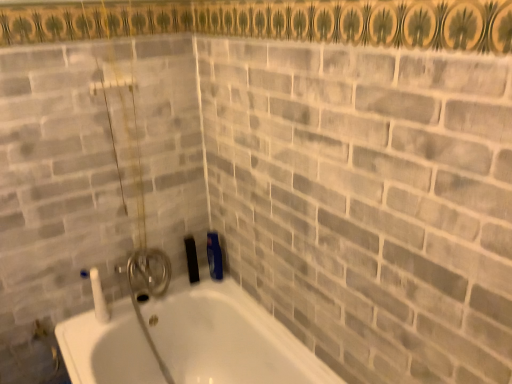
Where is `gray brick at upper center`? This screenshot has width=512, height=384. gray brick at upper center is located at coordinates (367, 201).

Describe the element at coordinates (367, 201) in the screenshot. I see `gray brick at upper center` at that location.

The width and height of the screenshot is (512, 384). Describe the element at coordinates (186, 340) in the screenshot. I see `white glossy bathtub at lower left` at that location.

Measure the distance between white glossy bathtub at lower left and camera.

The distance of white glossy bathtub at lower left from camera is 1.31 meters.

Identify the location of white glossy bathtub at lower left. This screenshot has width=512, height=384. (186, 340).

Identify the location of gray brick at upper center. [367, 201].

Considering the positions of objects white glossy bathtub at lower left and gray brick at upper center in the image provided, who is more to the left, white glossy bathtub at lower left or gray brick at upper center?

Positioned to the left is white glossy bathtub at lower left.

Which object is further away from the camera, white glossy bathtub at lower left or gray brick at upper center?

white glossy bathtub at lower left is further away from the camera.

Does point (276, 335) lie behind point (267, 95)?

That is True.

Based on the photo, from the image's perspective, which is below, white glossy bathtub at lower left or gray brick at upper center?

white glossy bathtub at lower left, from the image's perspective.

From a real-world perspective, between white glossy bathtub at lower left and gray brick at upper center, who is vertically higher?

gray brick at upper center.

Is white glossy bathtub at lower left thinner than gray brick at upper center?

Indeed, white glossy bathtub at lower left has a lesser width compared to gray brick at upper center.

Considering the relative sizes of white glossy bathtub at lower left and gray brick at upper center in the image provided, is white glossy bathtub at lower left shorter than gray brick at upper center?

Correct, white glossy bathtub at lower left is not as tall as gray brick at upper center.

Between white glossy bathtub at lower left and gray brick at upper center, which one has smaller size?

white glossy bathtub at lower left.

Is white glossy bathtub at lower left inside or outside of gray brick at upper center?

white glossy bathtub at lower left is located beyond the bounds of gray brick at upper center.

Consider the image. Can you see white glossy bathtub at lower left touching gray brick at upper center?

They are not placed beside each other.

Is white glossy bathtub at lower left oriented towards gray brick at upper center?

No, white glossy bathtub at lower left is not facing towards gray brick at upper center.

Can you tell me how much white glossy bathtub at lower left and gray brick at upper center differ in facing direction?

The angular difference between white glossy bathtub at lower left and gray brick at upper center is 3.3e-05 degrees.

This screenshot has height=384, width=512. In order to click on bathtub located behind the gray brick at upper center in this screenshot , I will do `click(186, 340)`.

Visually, is gray brick at upper center positioned to the left or to the right of white glossy bathtub at lower left?

gray brick at upper center is to the right of white glossy bathtub at lower left.

Is gray brick at upper center in front of white glossy bathtub at lower left?

Yes.

Considering the positions of points (267, 51) and (228, 364), is point (267, 51) farther from camera compared to point (228, 364)?

That is False.

From the image's perspective, is gray brick at upper center on top of white glossy bathtub at lower left?

Yes.

From a real-world perspective, relative to white glossy bathtub at lower left, is gray brick at upper center vertically above or below?

Clearly, from a real-world perspective, gray brick at upper center is above white glossy bathtub at lower left.

Between gray brick at upper center and white glossy bathtub at lower left, which one has smaller width?

white glossy bathtub at lower left.

In the scene shown: Who is taller, gray brick at upper center or white glossy bathtub at lower left?

With more height is gray brick at upper center.

Which of these two, gray brick at upper center or white glossy bathtub at lower left, is smaller?

With smaller size is white glossy bathtub at lower left.

Is gray brick at upper center spatially inside white glossy bathtub at lower left, or outside of it?

gray brick at upper center is spatially situated outside white glossy bathtub at lower left.

Would you say gray brick at upper center is a long distance from white glossy bathtub at lower left?

No, gray brick at upper center is not far away from white glossy bathtub at lower left.

Is gray brick at upper center oriented away from white glossy bathtub at lower left?

No, gray brick at upper center is not facing the opposite direction of white glossy bathtub at lower left.

What's the angular difference between gray brick at upper center and white glossy bathtub at lower left's facing directions?

3.3e-05 degrees separate the facing orientations of gray brick at upper center and white glossy bathtub at lower left.

Find the location of `brick above the white glossy bathtub at lower left (from a real-world perspective)`. brick above the white glossy bathtub at lower left (from a real-world perspective) is located at coordinates (367, 201).

The image size is (512, 384). I want to click on brick located in front of the white glossy bathtub at lower left, so click(367, 201).

Find the location of a particular element. The height and width of the screenshot is (384, 512). brick lying above the white glossy bathtub at lower left (from the image's perspective) is located at coordinates (367, 201).